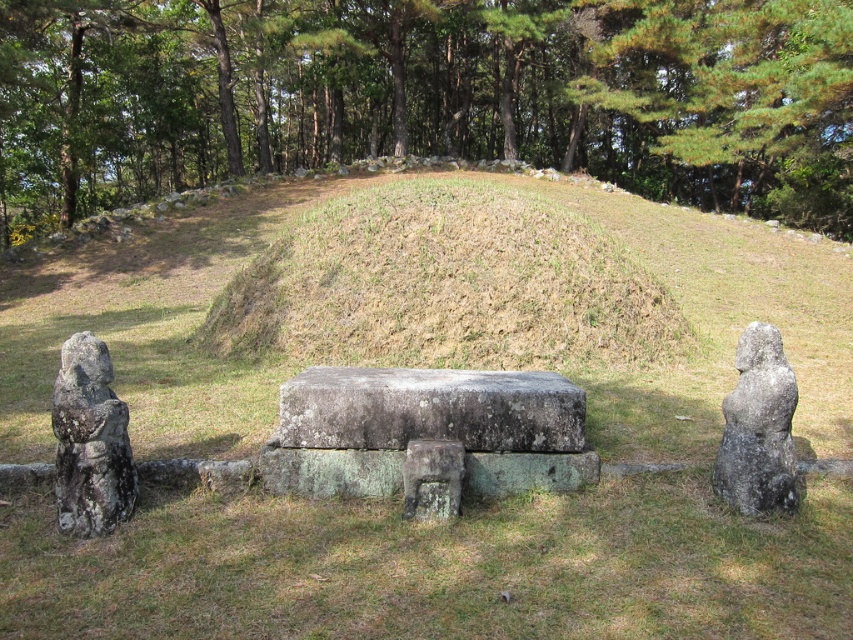
You are standing at the point labeled as point (x=430, y=410) in the image. What material are you standing on?

You are standing on gray weathered stone at center.